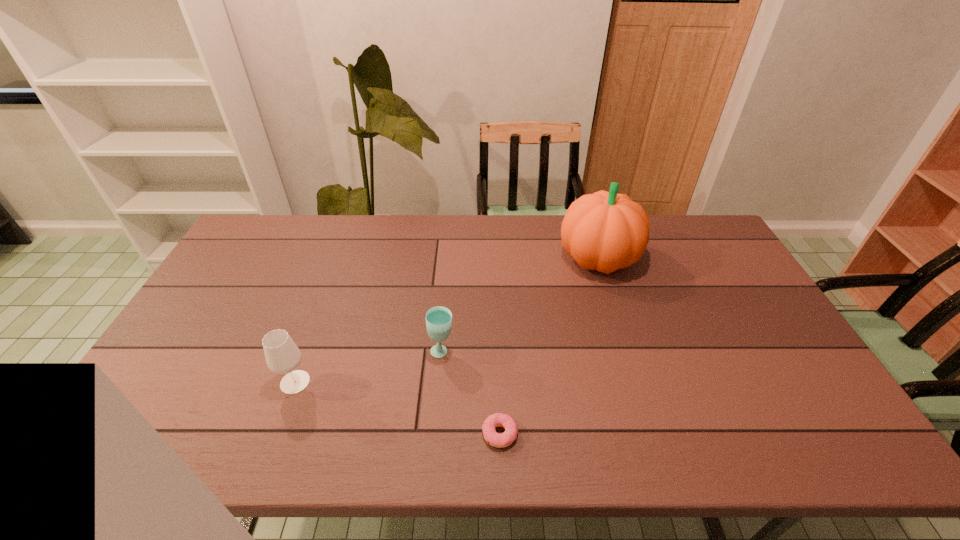
Image resolution: width=960 pixels, height=540 pixels. What are the coordinates of `pumpkin` in the screenshot? It's located at (604, 231).

Image resolution: width=960 pixels, height=540 pixels. What are the coordinates of `the tallest object` in the screenshot? It's located at (604, 231).

The image size is (960, 540). Identify the location of the taller glass. (282, 355).

The height and width of the screenshot is (540, 960). Identify the location of the left glass. (282, 355).

You are a GUI agent. You are given a task and a screenshot of the screen. Output one action in this format:
    pyautogui.click(x=<x>, y=<y>)
    Task: Click on the right glass
    
    Given the screenshot: What is the action you would take?
    pyautogui.click(x=438, y=319)

Find the location of `the farther glass`. the farther glass is located at coordinates (438, 319).

Where is `the shortest object`? This screenshot has width=960, height=540. the shortest object is located at coordinates (506, 438).

The width and height of the screenshot is (960, 540). I want to click on the third object from left to right, so click(x=506, y=438).

This screenshot has height=540, width=960. Identify the location of free location located 0.100m on the left of the farthest object. (527, 259).

Image resolution: width=960 pixels, height=540 pixels. I want to click on vacant space situated on the right of the taller glass, so click(369, 382).